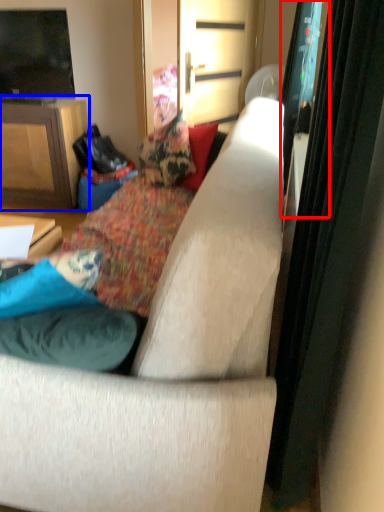
Question: Which point is further to the camera, screen door (highlighted by a red box) or cabinetry (highlighted by a blue box)?

Choices:
 (A) screen door
 (B) cabinetry

Answer: (B)